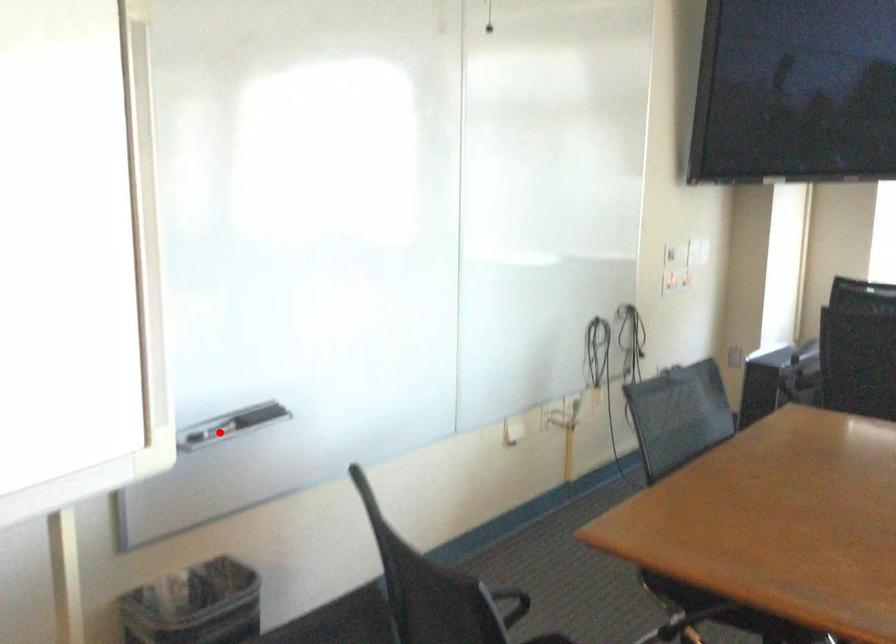
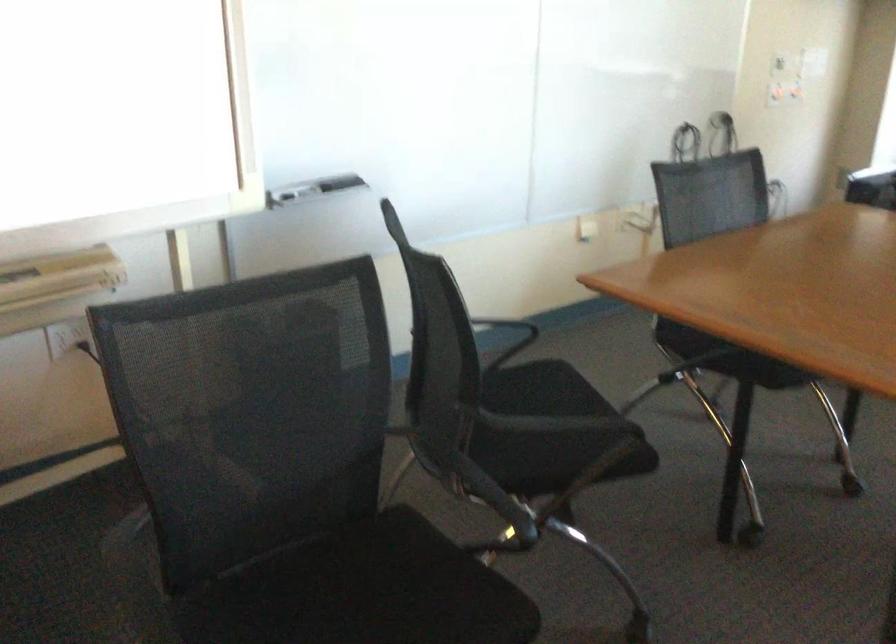
The point at the highlighted location is marked in the first image. Where is the corresponding point in the second image?

(312, 189)